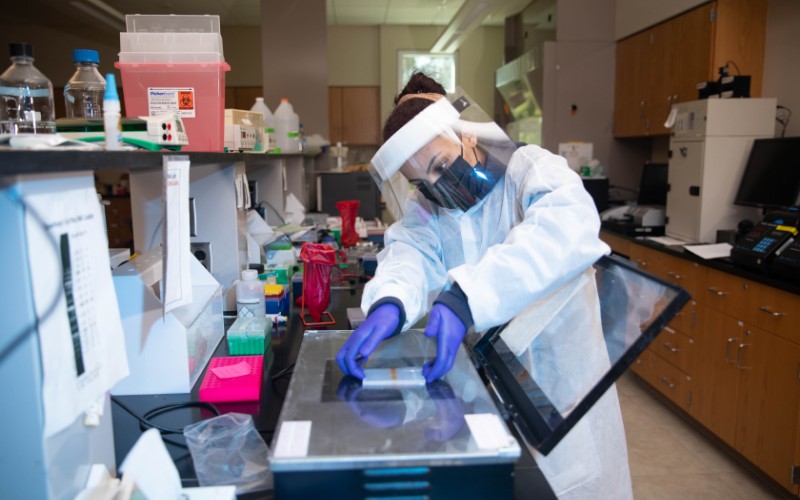
This screenshot has height=500, width=800. I want to click on cabinets, so click(x=746, y=431), click(x=728, y=341), click(x=684, y=69), click(x=652, y=76), click(x=646, y=260).